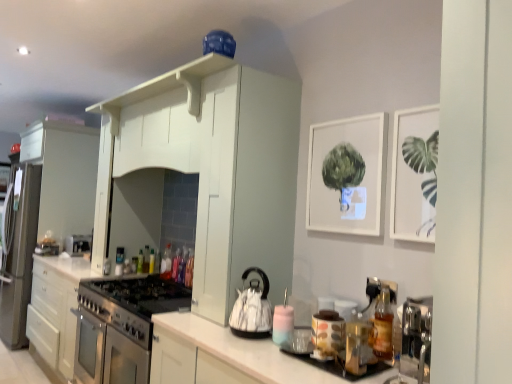
What do you see at coordinates (176, 265) in the screenshot? I see `translucent plastic bottle at center, which appears as the 5th bottle when viewed from the back` at bounding box center [176, 265].

In order to face translucent plastic bottle at center, which appears as the 5th bottle when viewed from the back, should I rotate leftwards or rightwards?

You should look left and rotate roughly 10.655 degrees.

The height and width of the screenshot is (384, 512). In order to click on matte black kettle at center in this screenshot , I will do `click(252, 309)`.

What do you see at coordinates (252, 309) in the screenshot? The image size is (512, 384). I see `matte black kettle at center` at bounding box center [252, 309].

The height and width of the screenshot is (384, 512). Describe the element at coordinates (151, 261) in the screenshot. I see `translucent plastic bottle at center, the 3th bottle in the left-to-right sequence` at that location.

What is the approximate height of translucent plastic bottle at center, placed as the 9th bottle when sorted from front to back?

7.77 inches.

The height and width of the screenshot is (384, 512). I want to click on satin white cabinet at center, which is the 3th cabinetry in front-to-back order, so click(97, 320).

What do you see at coordinates (97, 320) in the screenshot? I see `satin white cabinet at center, the 3th cabinetry positioned from the right` at bounding box center [97, 320].

Identify the location of green glass bottle at center, the second bottle when ordered from back to front. (146, 259).

Between point (184, 256) and point (144, 264), which one is positioned behind?

The point (144, 264) is more distant.

Is green glass bottle at center, arranged as the 8th bottle when viewed from the right, at the back of translucent plastic bottle at center, arranged as the fourth bottle when viewed from the right?

translucent plastic bottle at center, arranged as the fourth bottle when viewed from the right, is not turned away from green glass bottle at center, arranged as the 8th bottle when viewed from the right.

Which is more to the right, translucent plastic bottle at center, acting as the 4th bottle starting from the front, or green glass bottle at center, the 2th bottle from the left?

translucent plastic bottle at center, acting as the 4th bottle starting from the front, is more to the right.

In the scene shown: Does green glass bottle at center, the second bottle when ordered from back to front, lie behind translucent plastic bottle at center, the fourth bottle positioned from the back?

Yes, the depth of green glass bottle at center, the second bottle when ordered from back to front, is greater than that of translucent plastic bottle at center, the fourth bottle positioned from the back.

Considering the sizes of objects green glass bottle at center, which is the 8th bottle from front to back, and translucent plastic bottle at center, which ranks as the sixth bottle in front-to-back order, in the image provided, who is taller, green glass bottle at center, which is the 8th bottle from front to back, or translucent plastic bottle at center, which ranks as the sixth bottle in front-to-back order,?

translucent plastic bottle at center, which ranks as the sixth bottle in front-to-back order.

Which bottle is the 2nd one when counting from the right side of the green glass bottle at center, arranged as the 8th bottle when viewed from the right? Please provide its 2D coordinates.

[(166, 263)]

Consider the image. Which object is positioned more to the left, green glass bottle at center, the 2th bottle from the left, or translucent plastic bottle at center, positioned as the sixth bottle in right-to-left order?

green glass bottle at center, the 2th bottle from the left.

Is satin white cabinet at center, the 1th cabinetry from the back, touching translucent glass bottle at right, arranged as the 8th bottle when viewed from the left?

There is a gap between satin white cabinet at center, the 1th cabinetry from the back, and translucent glass bottle at right, arranged as the 8th bottle when viewed from the left.

Does satin white cabinet at center, which ranks as the first cabinetry in left-to-right order, appear on the right side of translucent glass bottle at right, the first bottle when ordered from front to back?

No.

From a real-world perspective, is satin white cabinet at center, the 1th cabinetry from the back, below translucent glass bottle at right, arranged as the 8th bottle when viewed from the left?

Indeed, from a real-world perspective, satin white cabinet at center, the 1th cabinetry from the back, is positioned beneath translucent glass bottle at right, arranged as the 8th bottle when viewed from the left.

Is satin white cabinet at center, which is the 3th cabinetry in front-to-back order, positioned with its back to translucent glass bottle at right, the second bottle when ordered from right to left?

No, satin white cabinet at center, which is the 3th cabinetry in front-to-back order, is not facing away from translucent glass bottle at right, the second bottle when ordered from right to left.

Is green glass bottle at center, which is the 8th bottle from front to back, shorter than translucent glass bottle at right, which is the 8th bottle in back-to-front order?

Indeed, green glass bottle at center, which is the 8th bottle from front to back, has a lesser height compared to translucent glass bottle at right, which is the 8th bottle in back-to-front order.

Is green glass bottle at center, arranged as the 8th bottle when viewed from the right, turned away from translucent glass bottle at right, which is counted as the ninth bottle, starting from the left?

green glass bottle at center, arranged as the 8th bottle when viewed from the right, does not have its back to translucent glass bottle at right, which is counted as the ninth bottle, starting from the left.

Consider the image. From the image's perspective, is green glass bottle at center, the 2th bottle from the left, beneath translucent glass bottle at right, which is the 8th bottle in back-to-front order?

Yes.

Looking at this image, which is more to the left, green glass bottle at center, which is the 8th bottle from front to back, or translucent glass bottle at right, which is the 8th bottle in back-to-front order?

green glass bottle at center, which is the 8th bottle from front to back.

Considering the sizes of translucent plastic bottle at center, arranged as the 9th bottle when viewed from the right, and matte black kettle at center in the image, is translucent plastic bottle at center, arranged as the 9th bottle when viewed from the right, bigger or smaller than matte black kettle at center?

translucent plastic bottle at center, arranged as the 9th bottle when viewed from the right, is smaller than matte black kettle at center.

Is translucent plastic bottle at center, which is counted as the 1th bottle, starting from the left, taller than matte black kettle at center?

No, translucent plastic bottle at center, which is counted as the 1th bottle, starting from the left, is not taller than matte black kettle at center.

Visually, is translucent plastic bottle at center, arranged as the 9th bottle when viewed from the right, positioned to the left or to the right of matte black kettle at center?

translucent plastic bottle at center, arranged as the 9th bottle when viewed from the right, is to the left of matte black kettle at center.

Considering the positions of objects translucent plastic bottle at center, the third bottle when ordered from front to back, and translucent plastic bottle at center, acting as the 4th bottle starting from the front, in the image provided, who is in front, translucent plastic bottle at center, the third bottle when ordered from front to back, or translucent plastic bottle at center, acting as the 4th bottle starting from the front,?

translucent plastic bottle at center, the third bottle when ordered from front to back, is more forward.

Find the location of a particular element. Image resolution: width=512 pixels, height=384 pixels. bottle that is the 2nd one when counting downward from the translucent plastic bottle at center, arranged as the fourth bottle when viewed from the right (from the image's perspective) is located at coordinates (189, 269).

Does translucent plastic bottle at center, positioned as the 7th bottle in back-to-front order, have a greater height compared to translucent plastic bottle at center, acting as the 4th bottle starting from the front?

Yes.

What's the angular difference between translucent plastic bottle at center, which is counted as the 6th bottle, starting from the left, and translucent plastic bottle at center, positioned as the 7th bottle in back-to-front order,'s facing directions?

The facing directions of translucent plastic bottle at center, which is counted as the 6th bottle, starting from the left, and translucent plastic bottle at center, positioned as the 7th bottle in back-to-front order, are 0.0848 degrees apart.

The height and width of the screenshot is (384, 512). What are the coordinates of `the 1st bottle counting from the left side of the translucent plastic bottle at center, marked as the seventh bottle in a left-to-right arrangement` in the screenshot? It's located at (182, 265).

From the image's perspective, is translucent plastic bottle at center, arranged as the fourth bottle when viewed from the right, on top of translucent plastic bottle at center, the third bottle from the right?

Yes, from the image's perspective, translucent plastic bottle at center, arranged as the fourth bottle when viewed from the right, is over translucent plastic bottle at center, the third bottle from the right.

From a real-world perspective, count 4th bottles downward from the translucent plastic bottle at center, arranged as the fourth bottle when viewed from the right, and point to it. Please provide its 2D coordinates.

[(146, 259)]

Where is `the 2nd bottle above the green glass bottle at center, the 2th bottle from the left (from the image's perspective)`? This screenshot has height=384, width=512. the 2nd bottle above the green glass bottle at center, the 2th bottle from the left (from the image's perspective) is located at coordinates (166, 263).

Looking at the image, which one is located closer to translucent plastic bottle at center, placed as the sixth bottle when sorted from back to front, translucent plastic bottle at center, the 3th bottle viewed from the back, or matte ceramic jar at center, positioned as the 1th appliance in right-to-left order?

Based on the image, translucent plastic bottle at center, the 3th bottle viewed from the back, appears to be nearer to translucent plastic bottle at center, placed as the sixth bottle when sorted from back to front.

When comparing their distances from translucent plastic bottle at center, which is the fifth bottle from front to back, does matte ceramic jar at center, which ranks as the first appliance in front-to-back order, or satin white cabinet at center, the 1th cabinetry from the back, seem closer?

Among the two, satin white cabinet at center, the 1th cabinetry from the back, is located nearer to translucent plastic bottle at center, which is the fifth bottle from front to back.

From the image, which object appears to be farther from white matte picture frame at upper center, which is counted as the second picture frame, starting from the front, satin white cabinet at center, which ranks as the first cabinetry in left-to-right order, or matte ceramic jar at center, the second appliance in the back-to-front sequence?

satin white cabinet at center, which ranks as the first cabinetry in left-to-right order, lies further to white matte picture frame at upper center, which is counted as the second picture frame, starting from the front, than the other object.

Which object lies nearer to the anchor point satin silver oven at center, positioned as the 1th appliance in left-to-right order, white glossy cabinet at center, which appears as the 3th cabinetry when viewed from the back, or translucent glass bottle at right, which appears as the 1th bottle when viewed from the right?

Among the two, white glossy cabinet at center, which appears as the 3th cabinetry when viewed from the back, is located nearer to satin silver oven at center, positioned as the 1th appliance in left-to-right order.

When comparing their distances from satin white cabinet at center, which ranks as the first cabinetry in left-to-right order, does translucent plastic bottle at center, which ranks as the sixth bottle in front-to-back order, or translucent glass bottle at right, the second bottle when ordered from right to left, seem further?

Among the two, translucent glass bottle at right, the second bottle when ordered from right to left, is located further to satin white cabinet at center, which ranks as the first cabinetry in left-to-right order.

Considering their positions, is translucent plastic bottle at center, arranged as the 9th bottle when viewed from the right, positioned closer to translucent glass bottle at right, the 2th bottle in the front-to-back sequence, than white matte picture frame at upper right, arranged as the 2th picture frame when viewed from the left?

white matte picture frame at upper right, arranged as the 2th picture frame when viewed from the left, is positioned closer to the anchor translucent glass bottle at right, the 2th bottle in the front-to-back sequence.

When comparing their distances from translucent plastic bottle at center, the 3th bottle in the left-to-right sequence, does translucent glass bottle at right, which is the 8th bottle in back-to-front order, or translucent plastic bottle at center, marked as the fifth bottle in a left-to-right arrangement, seem further?

translucent glass bottle at right, which is the 8th bottle in back-to-front order.

Based on the photo, which object lies further to the anchor point translucent glass bottle at right, the first bottle when ordered from front to back, translucent plastic bottle at center, marked as the seventh bottle in a left-to-right arrangement, or translucent plastic bottle at center, acting as the 4th bottle starting from the front?

Among the two, translucent plastic bottle at center, acting as the 4th bottle starting from the front, is located further to translucent glass bottle at right, the first bottle when ordered from front to back.

This screenshot has height=384, width=512. Identify the location of picture frame between matte ceramic jar at center, the second appliance in the back-to-front sequence, and translucent plastic bottle at center, arranged as the fourth bottle when viewed from the right, in the front-back direction. (346, 175).

Identify the location of appliance positioned between white glossy cabinet at center, which is counted as the 1th cabinetry, starting from the front, and translucent plastic bottle at center, which is the fifth bottle from right to left, from near to far. The image size is (512, 384). (327, 334).

You are a GUI agent. You are given a task and a screenshot of the screen. Output one action in this format:
    pyautogui.click(x=<x>, y=<y>)
    Task: Click on the appliance located between translucent glass bottle at right, which is the 8th bottle in back-to-front order, and translucent plastic bottle at center, the first bottle positioned from the back, in the depth direction
    The width and height of the screenshot is (512, 384).
    Given the screenshot: What is the action you would take?
    pyautogui.click(x=327, y=334)

Find the location of `kitchen appliance between translucent glass bottle at right, arranged as the 8th bottle when viewed from the left, and translucent plastic bottle at center, the 3th bottle viewed from the back, in the front-back direction`. kitchen appliance between translucent glass bottle at right, arranged as the 8th bottle when viewed from the left, and translucent plastic bottle at center, the 3th bottle viewed from the back, in the front-back direction is located at coordinates (252, 309).